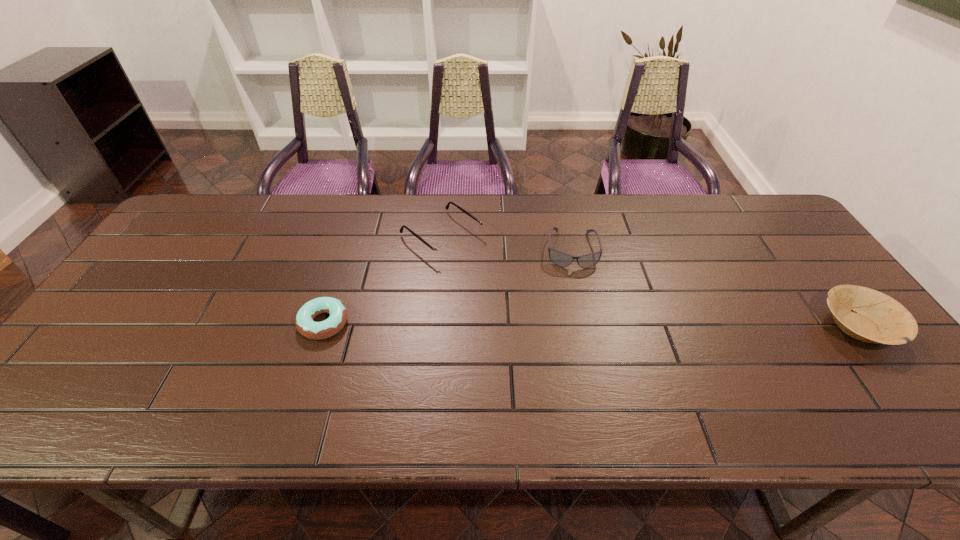
Where is `vacant area at the far left corner of the desktop`? vacant area at the far left corner of the desktop is located at coordinates (222, 226).

Locate an element on the screen. The image size is (960, 540). free area in between the leftmost object and the rightmost object is located at coordinates (590, 325).

Where is `vacant point located between the third object from left to right and the third object from right to left`? The height and width of the screenshot is (540, 960). vacant point located between the third object from left to right and the third object from right to left is located at coordinates (507, 243).

Where is `free space between the rightmost object and the third object from left to right`? free space between the rightmost object and the third object from left to right is located at coordinates (714, 288).

At what (x,y) coordinates should I click in order to perform the action: click on vacant point located between the spectacles and the doughnut. Please return your answer as a coordinate pair (x, y). The image size is (960, 540). Looking at the image, I should click on (383, 280).

This screenshot has height=540, width=960. Find the location of `vacant space in between the rightmost object and the spectacles`. vacant space in between the rightmost object and the spectacles is located at coordinates (650, 281).

Locate an element on the screen. The width and height of the screenshot is (960, 540). empty location between the spectacles and the bowl is located at coordinates (650, 281).

Locate an element on the screen. The width and height of the screenshot is (960, 540). vacant space that is in between the third object from left to right and the shortest object is located at coordinates (447, 286).

Identify the location of vacant space that is in between the spectacles and the sunglasses. (507, 243).

Where is `vacant space in between the third object from right to left and the sunglasses`? The height and width of the screenshot is (540, 960). vacant space in between the third object from right to left and the sunglasses is located at coordinates (507, 243).